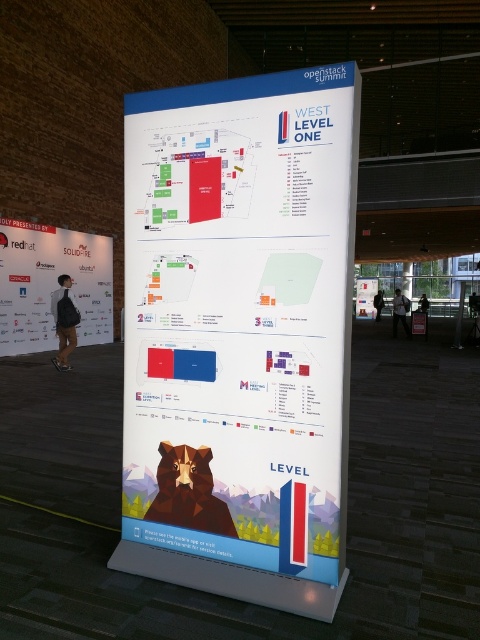
You are standing in front of the informational display board and want to read both the white matte banner at left and the white glossy poster at center. Which one do you need to move closer to in order to read?

The white matte banner at left is closer to the viewer, so you can read it without moving closer. However, the white glossy poster at center is farther away, so you would need to move closer to it to read.

You are organizing a presentation and need to refer to both the white paper at center and the white glossy poster at center on the display board. Which one is located above the other?

The white glossy poster at center is above the white paper at center because the white paper at center is positioned under it.